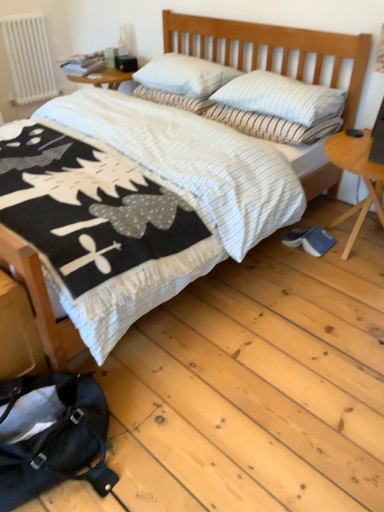
This screenshot has height=512, width=384. What do you see at coordinates (282, 98) in the screenshot?
I see `white striped pillow at upper center, arranged as the third pillow when viewed from the top` at bounding box center [282, 98].

Locate an element on the screen. white striped pillow at upper center, the fourth pillow from the top is located at coordinates (272, 125).

The width and height of the screenshot is (384, 512). What do you see at coordinates (272, 125) in the screenshot? I see `white striped pillow at upper center, which is the 1th pillow from bottom to top` at bounding box center [272, 125].

At what (x,y) coordinates should I click in order to perform the action: click on white striped pillow at center, the third pillow positioned from the bottom. Please return your answer as a coordinate pair (x, y). Looking at the image, I should click on (174, 99).

How much space does white striped pillow at center, acting as the second pillow starting from the top, occupy horizontally?

It is 19.02 inches.

The width and height of the screenshot is (384, 512). What do you see at coordinates (277, 47) in the screenshot? I see `white quilted bed at center` at bounding box center [277, 47].

In order to face black leather messenger bag at lower left, should I rotate leftwards or rightwards?

To align with it, rotate left about 19.320°.

Where is `white painted metal radiator at upper left`? white painted metal radiator at upper left is located at coordinates (29, 57).

I want to click on white striped pillow at upper center, arranged as the third pillow when viewed from the top, so click(282, 98).

This screenshot has width=384, height=512. I want to click on the 1st pillow counting from the right of the white quilted bed at center, so click(174, 99).

In the scene shown: From the image's perspective, is white striped pillow at center, the third pillow positioned from the bottom, below white quilted bed at center?

No, from the image's perspective, white striped pillow at center, the third pillow positioned from the bottom, is not below white quilted bed at center.

Is white striped pillow at center, acting as the second pillow starting from the top, located outside white quilted bed at center?

No, white striped pillow at center, acting as the second pillow starting from the top, is inside or overlapping with white quilted bed at center.

Is black leather messenger bag at lower left far from white striped pillow at center, acting as the second pillow starting from the top?

black leather messenger bag at lower left is far away from white striped pillow at center, acting as the second pillow starting from the top.

Is black leather messenger bag at lower left positioned with its back to white striped pillow at center, acting as the second pillow starting from the top?

No, black leather messenger bag at lower left is not facing away from white striped pillow at center, acting as the second pillow starting from the top.

Which of these two, black leather messenger bag at lower left or white striped pillow at center, acting as the second pillow starting from the top, stands taller?

black leather messenger bag at lower left.

Considering the positions of objects black leather messenger bag at lower left and white striped pillow at center, acting as the second pillow starting from the top, in the image provided, who is more to the left, black leather messenger bag at lower left or white striped pillow at center, acting as the second pillow starting from the top,?

Positioned to the left is black leather messenger bag at lower left.

Would you say white striped pillow at center, marked as the 1th pillow in a top-to-bottom arrangement, is part of black leather messenger bag at lower left's contents?

No, black leather messenger bag at lower left does not contain white striped pillow at center, marked as the 1th pillow in a top-to-bottom arrangement.

Which is more to the right, black leather messenger bag at lower left or white striped pillow at center, placed as the fourth pillow when sorted from bottom to top?

Positioned to the right is white striped pillow at center, placed as the fourth pillow when sorted from bottom to top.

Which is more distant, [65,391] or [189,85]?

Point [189,85]

You are a GUI agent. You are given a task and a screenshot of the screen. Output one action in this format:
    pyautogui.click(x=<x>, y=<y>)
    Task: Click on the pillow that is the 4th one when counting upward from the black leather messenger bag at lower left (from the image's perspective)
    This screenshot has height=512, width=384.
    Given the screenshot: What is the action you would take?
    pyautogui.click(x=185, y=75)

Can you confirm if white striped pillow at upper center, arranged as the third pillow when viewed from the top, is positioned to the right of white striped pillow at center, acting as the second pillow starting from the top?

Yes, white striped pillow at upper center, arranged as the third pillow when viewed from the top, is to the right of white striped pillow at center, acting as the second pillow starting from the top.

Is white striped pillow at center, acting as the second pillow starting from the top, inside white striped pillow at upper center, which ranks as the second pillow in bottom-to-top order?

Actually, white striped pillow at center, acting as the second pillow starting from the top, is outside white striped pillow at upper center, which ranks as the second pillow in bottom-to-top order.

Locate an element on the screen. pillow that is the 3rd object located behind the white striped pillow at upper center, arranged as the third pillow when viewed from the top is located at coordinates (174, 99).

Measure the distance between white striped pillow at upper center, arranged as the third pillow when viewed from the top, and white striped pillow at center, the third pillow positioned from the bottom.

15.53 inches.

Is white quilted bed at center positioned beyond the bounds of white striped pillow at center, placed as the fourth pillow when sorted from bottom to top?

Yes, white quilted bed at center is outside of white striped pillow at center, placed as the fourth pillow when sorted from bottom to top.

Which object is further away from the camera taking this photo, white quilted bed at center or white striped pillow at center, placed as the fourth pillow when sorted from bottom to top?

Positioned behind is white striped pillow at center, placed as the fourth pillow when sorted from bottom to top.

Which of these two, white quilted bed at center or white striped pillow at center, placed as the fourth pillow when sorted from bottom to top, is wider?

white quilted bed at center is wider.

From a real-world perspective, between white quilted bed at center and white striped pillow at center, marked as the 1th pillow in a top-to-bottom arrangement, who is vertically higher?

In real-world perspective, white striped pillow at center, marked as the 1th pillow in a top-to-bottom arrangement, is above.

Is white painted metal radiator at upper left far away from white striped pillow at center, marked as the 1th pillow in a top-to-bottom arrangement?

white painted metal radiator at upper left is positioned a significant distance from white striped pillow at center, marked as the 1th pillow in a top-to-bottom arrangement.

From the image's perspective, is white painted metal radiator at upper left located above or below white striped pillow at center, placed as the fourth pillow when sorted from bottom to top?

From the image's perspective, white painted metal radiator at upper left appears above white striped pillow at center, placed as the fourth pillow when sorted from bottom to top.

Between white painted metal radiator at upper left and white striped pillow at center, placed as the fourth pillow when sorted from bottom to top, which one appears on the left side from the viewer's perspective?

white painted metal radiator at upper left is more to the left.

Can you confirm if white striped pillow at center, placed as the fourth pillow when sorted from bottom to top, is thinner than white quilted bed at center?

Yes.

Can you confirm if white striped pillow at center, marked as the 1th pillow in a top-to-bottom arrangement, is bigger than white quilted bed at center?

No.

Which is behind, white striped pillow at center, placed as the fourth pillow when sorted from bottom to top, or white quilted bed at center?

Positioned behind is white striped pillow at center, placed as the fourth pillow when sorted from bottom to top.

Based on the photo, which is more to the right, white striped pillow at center, marked as the 1th pillow in a top-to-bottom arrangement, or white quilted bed at center?

Positioned to the right is white striped pillow at center, marked as the 1th pillow in a top-to-bottom arrangement.

Locate an element on the screen. This screenshot has height=512, width=384. bed below the white striped pillow at center, acting as the second pillow starting from the top (from the image's perspective) is located at coordinates (277, 47).

Where is `messenger bag in front of the white striped pillow at center, the third pillow positioned from the bottom`? messenger bag in front of the white striped pillow at center, the third pillow positioned from the bottom is located at coordinates 51,435.

Based on their spatial positions, is white striped pillow at upper center, which ranks as the second pillow in bottom-to-top order, or black leather messenger bag at lower left closer to white striped pillow at center, marked as the 1th pillow in a top-to-bottom arrangement?

white striped pillow at upper center, which ranks as the second pillow in bottom-to-top order, lies closer to white striped pillow at center, marked as the 1th pillow in a top-to-bottom arrangement, than the other object.

Based on their spatial positions, is white quilted bed at center or white striped pillow at upper center, which ranks as the second pillow in bottom-to-top order, closer to white striped pillow at upper center, which is the 1th pillow from bottom to top?

white striped pillow at upper center, which ranks as the second pillow in bottom-to-top order, is positioned closer to the anchor white striped pillow at upper center, which is the 1th pillow from bottom to top.

Which object lies nearer to the anchor point white striped pillow at center, acting as the second pillow starting from the top, white striped pillow at upper center, which ranks as the second pillow in bottom-to-top order, or white quilted bed at center?

The object closer to white striped pillow at center, acting as the second pillow starting from the top, is white striped pillow at upper center, which ranks as the second pillow in bottom-to-top order.

Considering their positions, is white striped pillow at center, the third pillow positioned from the bottom, positioned closer to white striped pillow at upper center, arranged as the third pillow when viewed from the top, than white striped pillow at center, placed as the fourth pillow when sorted from bottom to top?

The object closer to white striped pillow at upper center, arranged as the third pillow when viewed from the top, is white striped pillow at center, the third pillow positioned from the bottom.

In the scene shown: When comparing their distances from white striped pillow at center, the third pillow positioned from the bottom, does white striped pillow at center, marked as the 1th pillow in a top-to-bottom arrangement, or white striped pillow at upper center, arranged as the third pillow when viewed from the top, seem closer?

white striped pillow at center, marked as the 1th pillow in a top-to-bottom arrangement, is positioned closer to the anchor white striped pillow at center, the third pillow positioned from the bottom.

Looking at the image, which one is located closer to white striped pillow at upper center, arranged as the third pillow when viewed from the top, white striped pillow at center, acting as the second pillow starting from the top, or black leather messenger bag at lower left?

white striped pillow at center, acting as the second pillow starting from the top, lies closer to white striped pillow at upper center, arranged as the third pillow when viewed from the top, than the other object.

From the picture: Which object lies further to the anchor point white striped pillow at center, acting as the second pillow starting from the top, white striped pillow at upper center, which is the 1th pillow from bottom to top, or white quilted bed at center?

white quilted bed at center.

When comparing their distances from white striped pillow at center, marked as the 1th pillow in a top-to-bottom arrangement, does white striped pillow at center, the third pillow positioned from the bottom, or white striped pillow at upper center, arranged as the third pillow when viewed from the top, seem further?

white striped pillow at upper center, arranged as the third pillow when viewed from the top, is further to white striped pillow at center, marked as the 1th pillow in a top-to-bottom arrangement.

This screenshot has width=384, height=512. I want to click on pillow situated between white striped pillow at center, acting as the second pillow starting from the top, and white striped pillow at upper center, the fourth pillow from the top, from left to right, so click(x=185, y=75).

Identify the location of messenger bag between white quilted bed at center and white striped pillow at center, acting as the second pillow starting from the top, along the z-axis. Image resolution: width=384 pixels, height=512 pixels. (51, 435).

At what (x,y) coordinates should I click in order to perform the action: click on pillow between white quilted bed at center and white striped pillow at upper center, the fourth pillow from the top, in the front-back direction. Please return your answer as a coordinate pair (x, y). Image resolution: width=384 pixels, height=512 pixels. Looking at the image, I should click on coord(282,98).

Where is `bed that lies between white striped pillow at center, marked as the 1th pillow in a top-to-bottom arrangement, and black leather messenger bag at lower left from top to bottom`? The image size is (384, 512). bed that lies between white striped pillow at center, marked as the 1th pillow in a top-to-bottom arrangement, and black leather messenger bag at lower left from top to bottom is located at coordinates (277, 47).